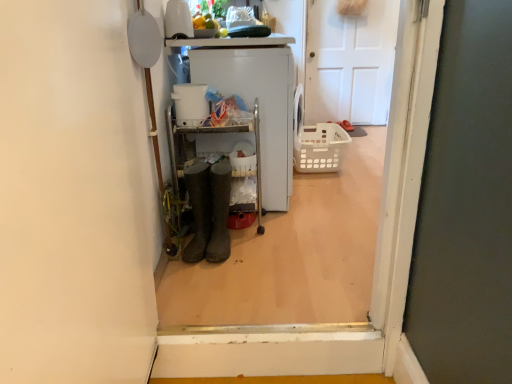
Identify the location of space that is in front of brown rubber boots at center, arranged as the 1th footwear when viewed from the right. (220, 279).